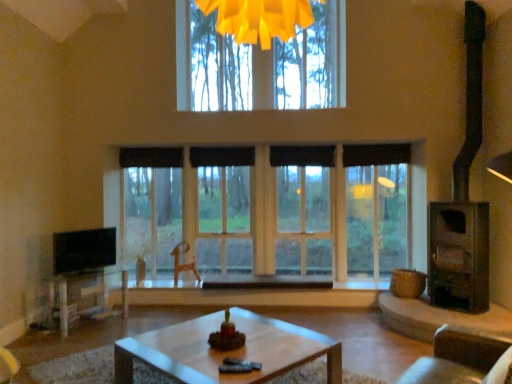
This screenshot has width=512, height=384. In order to click on black fabric curtain at center, the 2th curtain from the left in this screenshot , I will do `click(222, 156)`.

Find the location of a particular element. The image size is (512, 384). translucent plastic swivel chair at center is located at coordinates (183, 264).

From the image's perspective, is black fabric curtain at center, marked as the 2th curtain in a right-to-left arrangement, on top of clear glass window at center?

Correct, black fabric curtain at center, marked as the 2th curtain in a right-to-left arrangement, appears higher than clear glass window at center in the image.

Is point (282, 165) closer to viewer compared to point (413, 222)?

No.

Who is taller, black fabric curtain at center, which is the 3th curtain in left-to-right order, or clear glass window at center?

Standing taller between the two is clear glass window at center.

From the picture: Is black fabric curtain at center, marked as the 2th curtain in a right-to-left arrangement, spatially inside clear glass window at center, or outside of it?

black fabric curtain at center, marked as the 2th curtain in a right-to-left arrangement, is located inside clear glass window at center.

Does clear glass window at center have a smaller size compared to translucent plastic swivel chair at center?

No, clear glass window at center is not smaller than translucent plastic swivel chair at center.

The height and width of the screenshot is (384, 512). I want to click on window that appears above the translucent plastic swivel chair at center (from the image's perspective), so click(284, 218).

Considering the positions of objects clear glass window at center and translucent plastic swivel chair at center in the image provided, who is in front, clear glass window at center or translucent plastic swivel chair at center?

translucent plastic swivel chair at center.

Can you confirm if clear glass window at center is wider than translucent plastic swivel chair at center?

Indeed, clear glass window at center has a greater width compared to translucent plastic swivel chair at center.

Is translucent plastic swivel chair at center oriented away from black glossy tv at left?

No, black glossy tv at left is not at the back of translucent plastic swivel chair at center.

Considering the positions of objects translucent plastic swivel chair at center and black glossy tv at left in the image provided, who is behind, translucent plastic swivel chair at center or black glossy tv at left?

Positioned behind is translucent plastic swivel chair at center.

Is translucent plastic swivel chair at center inside the boundaries of black glossy tv at left, or outside?

translucent plastic swivel chair at center is not inside black glossy tv at left, it's outside.

Would you say translucent plastic swivel chair at center is a long distance from black glossy tv at left?

Yes, translucent plastic swivel chair at center and black glossy tv at left are quite far apart.

Which is more to the right, clear glass window at center or black glossy tv at left?

clear glass window at center is more to the right.

Considering the positions of points (385, 211) and (58, 272), is point (385, 211) closer to camera compared to point (58, 272)?

No, it is not.

Is clear glass window at center next to black glossy tv at left?

No, clear glass window at center is not beside black glossy tv at left.

From the picture: Considering the positions of objects black matte curtain at upper center, acting as the fourth curtain starting from the right, and dark gray metallic fireplace at right in the image provided, who is more to the right, black matte curtain at upper center, acting as the fourth curtain starting from the right, or dark gray metallic fireplace at right?

dark gray metallic fireplace at right is more to the right.

From a real-world perspective, which object stands above the other?

black matte curtain at upper center, the 1th curtain viewed from the left, is physically above.

From the image's perspective, is black matte curtain at upper center, the 1th curtain viewed from the left, over dark gray metallic fireplace at right?

Indeed, from the image's perspective, black matte curtain at upper center, the 1th curtain viewed from the left, is shown above dark gray metallic fireplace at right.

Locate an element on the screen. fireplace on the right side of white glossy coffee table at lower center is located at coordinates (463, 200).

Is dark gray metallic fireplace at right oriented towards white glossy coffee table at lower center?

No, dark gray metallic fireplace at right is not turned towards white glossy coffee table at lower center.

From a real-world perspective, between dark gray metallic fireplace at right and white glossy coffee table at lower center, who is vertically higher?

dark gray metallic fireplace at right, from a real-world perspective.

What's the angular difference between dark gray metallic fireplace at right and white glossy coffee table at lower center's facing directions?

The angle between the facing direction of dark gray metallic fireplace at right and the facing direction of white glossy coffee table at lower center is 136 degrees.

From the image's perspective, is black matte curtain at upper center, the 1th curtain viewed from the left, located above or below translucent plastic swivel chair at center?

From the image's perspective, black matte curtain at upper center, the 1th curtain viewed from the left, appears above translucent plastic swivel chair at center.

Would you say translucent plastic swivel chair at center is part of black matte curtain at upper center, acting as the fourth curtain starting from the right,'s contents?

Definitely not — translucent plastic swivel chair at center is not inside black matte curtain at upper center, acting as the fourth curtain starting from the right.

Is black matte curtain at upper center, the 1th curtain viewed from the left, oriented away from translucent plastic swivel chair at center?

No, black matte curtain at upper center, the 1th curtain viewed from the left,'s orientation is not away from translucent plastic swivel chair at center.

Does black matte curtain at upper center, the 1th curtain viewed from the left, lie in front of translucent plastic swivel chair at center?

No, black matte curtain at upper center, the 1th curtain viewed from the left, is further to the viewer.

What are the coordinates of `window on the left side of black fabric curtain at center, which is the 3th curtain in left-to-right order` in the screenshot? It's located at (284, 218).

Locate an element on the screen. window on the right of the translucent plastic swivel chair at center is located at coordinates (284, 218).

From the image, which object appears to be nearer to black glossy tv at left, white glossy coffee table at lower center or black fabric curtain at center, acting as the third curtain starting from the right?

The object closer to black glossy tv at left is black fabric curtain at center, acting as the third curtain starting from the right.

Estimate the real-world distances between objects in this image. Which object is further from black fabric curtain at upper center, the 4th curtain when ordered from left to right, black glossy tv at left or dark gray metallic fireplace at right?

black glossy tv at left is positioned further to the anchor black fabric curtain at upper center, the 4th curtain when ordered from left to right.

When comparing their distances from translucent plastic swivel chair at center, does black fabric curtain at upper center, positioned as the first curtain in right-to-left order, or black fabric curtain at center, which is the 3th curtain in left-to-right order, seem closer?

black fabric curtain at center, which is the 3th curtain in left-to-right order, lies closer to translucent plastic swivel chair at center than the other object.

Based on their spatial positions, is black fabric curtain at upper center, the 4th curtain when ordered from left to right, or black fabric curtain at center, which is the 3th curtain in left-to-right order, closer to black glossy tv at left?

black fabric curtain at center, which is the 3th curtain in left-to-right order, is closer to black glossy tv at left.

Estimate the real-world distances between objects in this image. Which object is further from black matte curtain at upper center, acting as the fourth curtain starting from the right, black fabric curtain at center, the 2th curtain from the left, or black fabric curtain at upper center, positioned as the first curtain in right-to-left order?

black fabric curtain at upper center, positioned as the first curtain in right-to-left order.

When comparing their distances from dark gray metallic fireplace at right, does black matte curtain at upper center, acting as the fourth curtain starting from the right, or black glossy tv at left seem further?

The object further to dark gray metallic fireplace at right is black glossy tv at left.

Based on their spatial positions, is white glossy coffee table at lower center or dark gray metallic fireplace at right closer to black fabric curtain at center, marked as the 2th curtain in a right-to-left arrangement?

The object closer to black fabric curtain at center, marked as the 2th curtain in a right-to-left arrangement, is dark gray metallic fireplace at right.

Based on their spatial positions, is black fabric curtain at center, which is the 3th curtain in left-to-right order, or black matte curtain at upper center, the 1th curtain viewed from the left, closer to black glossy tv at left?

The object closer to black glossy tv at left is black matte curtain at upper center, the 1th curtain viewed from the left.

Locate an element on the screen. swivel chair located between black matte curtain at upper center, acting as the fourth curtain starting from the right, and black fabric curtain at center, which is the 3th curtain in left-to-right order, in the left-right direction is located at coordinates (183, 264).

Where is `swivel chair between wooden coffee table at lower left and dark gray metallic fireplace at right in the horizontal direction`? The width and height of the screenshot is (512, 384). swivel chair between wooden coffee table at lower left and dark gray metallic fireplace at right in the horizontal direction is located at coordinates (183, 264).

This screenshot has height=384, width=512. Find the location of `swivel chair between black matte curtain at upper center, acting as the fourth curtain starting from the right, and black fabric curtain at upper center, positioned as the first curtain in right-to-left order, in the horizontal direction`. swivel chair between black matte curtain at upper center, acting as the fourth curtain starting from the right, and black fabric curtain at upper center, positioned as the first curtain in right-to-left order, in the horizontal direction is located at coordinates (183, 264).

The width and height of the screenshot is (512, 384). Identify the location of level located between white glossy coffee table at lower center and clear glass window at center in the depth direction. [83, 250].